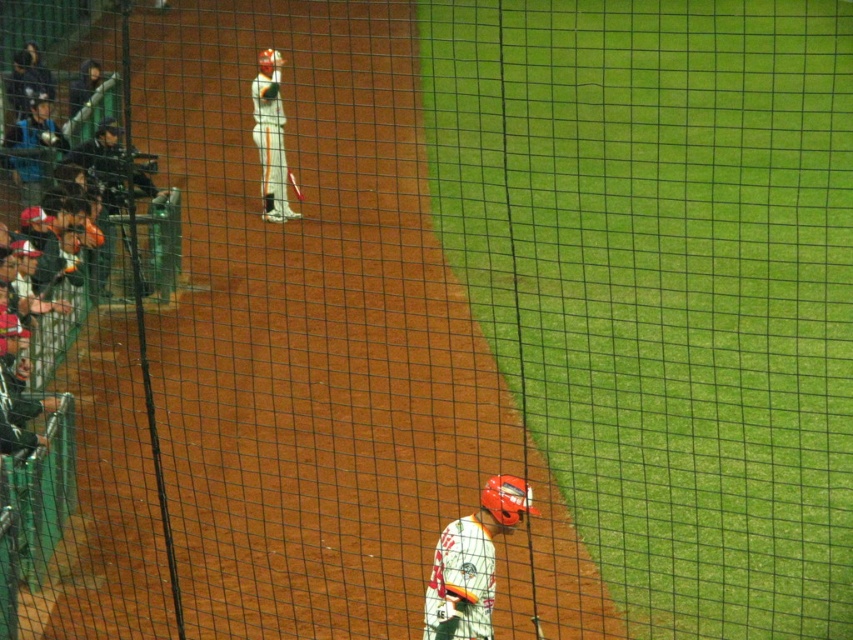
You are a photographer standing behind the protective netting in the baseball game scene. You want to capture a clear shot of both the white jersey at lower center and the white matte uniform at center. Considering their sizes, which one might appear smaller in your photo?

The white jersey at lower center has a lesser width compared to the white matte uniform at center, so it will appear smaller in the photo.

You are a spectator standing behind the protective netting. You see the white jersey at lower center and the matte black helmet at left. Which object is closer to you?

The white jersey at lower center is closer to you because it is in front of the matte black helmet at left.

You are a spectator sitting behind the netting and want to point out the player in the white jersey at lower center to a friend. Which direction should you direct your friend to look relative to the matte black helmet at left?

The white jersey at lower center is to the right of the matte black helmet at left, so you should direct your friend to look to the right of the matte black helmet at left.